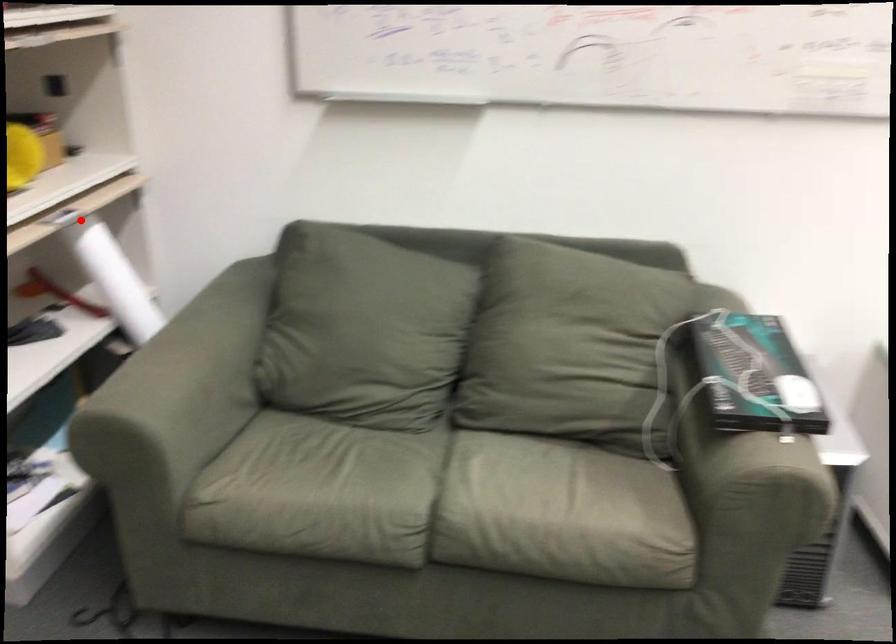
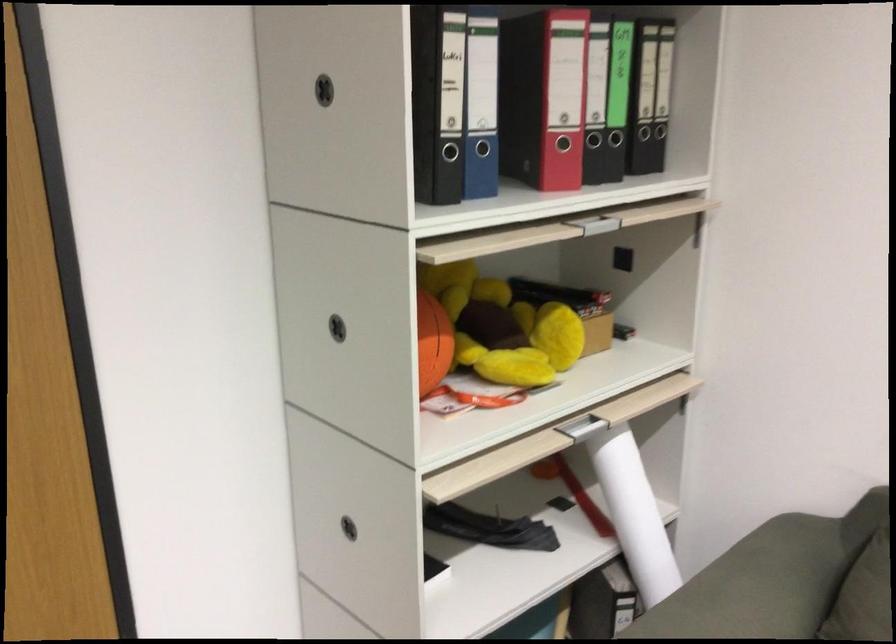
Where in the second image is the point corresponding to the highlighted location from the first image?

(595, 421)